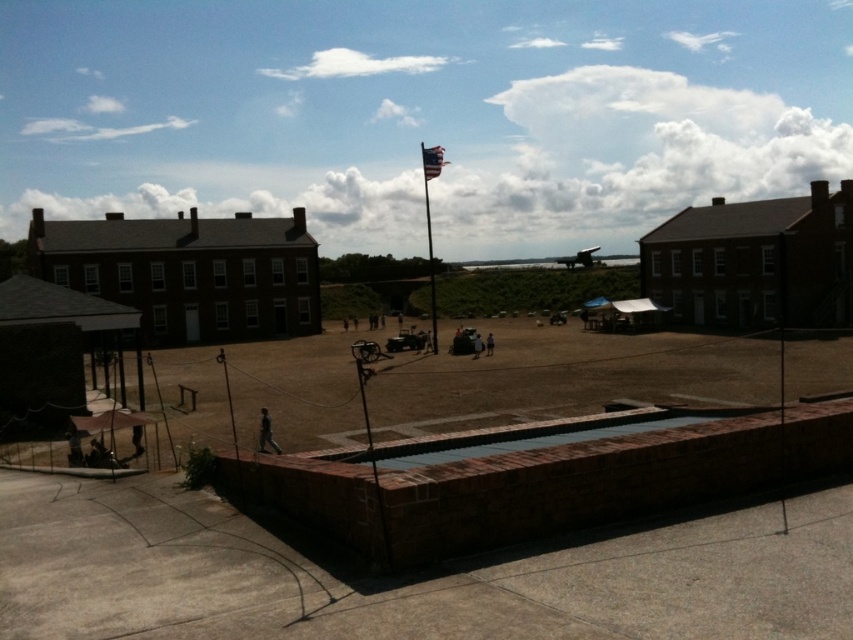
Who is positioned more to the left, brown dirt field at center or metallic flagpole at upper center?

metallic flagpole at upper center

Can you confirm if brown dirt field at center is positioned to the left of metallic flagpole at upper center?

In fact, brown dirt field at center is to the right of metallic flagpole at upper center.

Which is in front, point (444, 355) or point (434, 154)?

Point (434, 154)

At what (x,y) coordinates should I click in order to perform the action: click on brown dirt field at center. Please return your answer as a coordinate pair (x, y). Looking at the image, I should click on (566, 378).